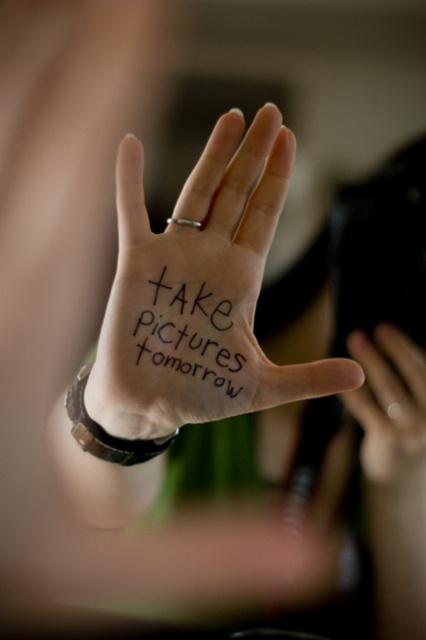
Is white smooth palm at center smaller than smooth skin hand at center?

No.

Who is taller, white smooth palm at center or smooth skin hand at center?

With more height is white smooth palm at center.

Between point (226, 413) and point (356, 333), which one is positioned behind?

The point (356, 333) is more distant.

Find the location of a particular element. The image size is (426, 640). white smooth palm at center is located at coordinates (198, 292).

Who is taller, black ink writing at center or smooth skin hand at center?

With more height is smooth skin hand at center.

Which is in front, point (207, 364) or point (365, 436)?

Point (207, 364)

Image resolution: width=426 pixels, height=640 pixels. I want to click on black ink writing at center, so (189, 337).

Can you confirm if white smooth palm at center is taller than black ink writing at center?

Yes, white smooth palm at center is taller than black ink writing at center.

Is point (132, 300) positioned behind point (227, 364)?

No.

Find the location of a particular element. white smooth palm at center is located at coordinates [x=198, y=292].